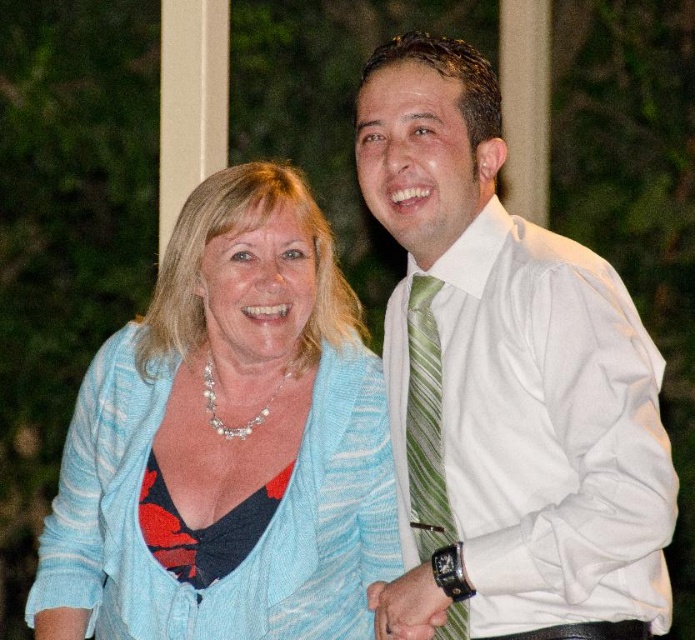
You are a photographer who wants to adjust the lighting so that the white smooth shirt at center and the light blue knit cardigan at center are equally illuminated. Which object should you move closer to the light source?

The light blue knit cardigan at center should be moved closer to the light source because the white smooth shirt at center is already positioned to the right of it, meaning it might already be closer to the light source.